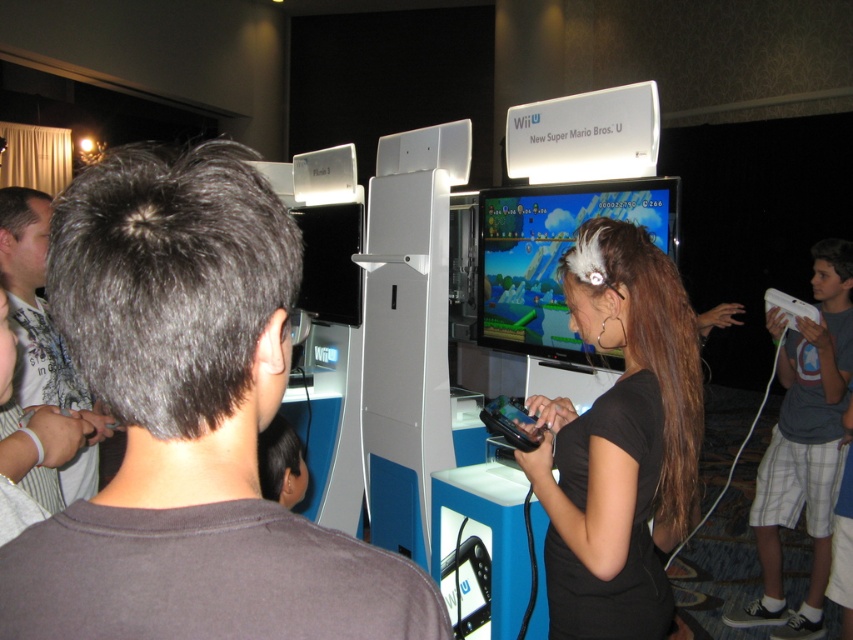
From the picture: Between dark brown hair at center and white matte controller at right, which one appears on the left side from the viewer's perspective?

dark brown hair at center

Is dark brown hair at center above white matte controller at right?

Yes.

Identify the location of dark brown hair at center. (190, 424).

Can you confirm if white matte controller at right is positioned above gray matte hair at upper left?

Actually, white matte controller at right is below gray matte hair at upper left.

Looking at this image, who is lower down, white matte controller at right or gray matte hair at upper left?

white matte controller at right

This screenshot has height=640, width=853. Find the location of `white matte controller at right`. white matte controller at right is located at coordinates click(x=804, y=445).

Between point (827, 476) and point (776, 305), which one is positioned in front?

Point (827, 476) is more forward.

Does white matte controller at right appear under white matte game controller at upper right?

Yes, white matte controller at right is below white matte game controller at upper right.

The height and width of the screenshot is (640, 853). Describe the element at coordinates (804, 445) in the screenshot. I see `white matte controller at right` at that location.

Find the location of `white matte controller at right`. white matte controller at right is located at coordinates (804, 445).